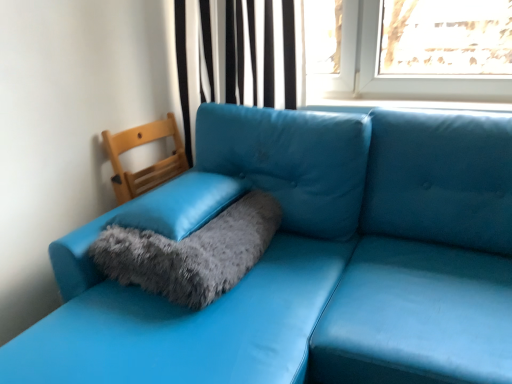
Question: Does fuzzy gray cat bed at center come behind matte blue leather couch at lower left?

Choices:
 (A) no
 (B) yes

Answer: (B)

Question: Is fuzzy gray cat bed at center located outside matte blue leather couch at lower left?

Choices:
 (A) yes
 (B) no

Answer: (B)

Question: Does fuzzy gray cat bed at center have a greater width compared to matte blue leather couch at lower left?

Choices:
 (A) yes
 (B) no

Answer: (B)

Question: Can you confirm if fuzzy gray cat bed at center is shorter than matte blue leather couch at lower left?

Choices:
 (A) no
 (B) yes

Answer: (B)

Question: From a real-world perspective, does fuzzy gray cat bed at center sit lower than matte blue leather couch at lower left?

Choices:
 (A) no
 (B) yes

Answer: (A)

Question: In terms of width, does black striped curtain at upper center look wider or thinner when compared to fuzzy gray pillow at center?

Choices:
 (A) wide
 (B) thin

Answer: (B)

Question: Is point (211, 46) closer or farther from the camera than point (217, 203)?

Choices:
 (A) farther
 (B) closer

Answer: (A)

Question: From a real-world perspective, relative to fuzzy gray pillow at center, is black striped curtain at upper center vertically above or below?

Choices:
 (A) above
 (B) below

Answer: (A)

Question: In the image, is black striped curtain at upper center positioned in front of or behind fuzzy gray pillow at center?

Choices:
 (A) behind
 (B) front

Answer: (A)

Question: Looking at their shapes, would you say fuzzy gray pillow at center is wider or thinner than black striped curtain at upper center?

Choices:
 (A) wide
 (B) thin

Answer: (A)

Question: Considering the positions of fuzzy gray pillow at center and black striped curtain at upper center in the image, is fuzzy gray pillow at center taller or shorter than black striped curtain at upper center?

Choices:
 (A) tall
 (B) short

Answer: (B)

Question: Visually, is fuzzy gray pillow at center positioned to the left or to the right of black striped curtain at upper center?

Choices:
 (A) left
 (B) right

Answer: (A)

Question: From a real-world perspective, is fuzzy gray pillow at center above or below black striped curtain at upper center?

Choices:
 (A) above
 (B) below

Answer: (B)

Question: Is black striped curtain at upper center inside or outside of matte blue leather couch at lower left?

Choices:
 (A) inside
 (B) outside

Answer: (B)

Question: Looking at their shapes, would you say black striped curtain at upper center is wider or thinner than matte blue leather couch at lower left?

Choices:
 (A) thin
 (B) wide

Answer: (A)